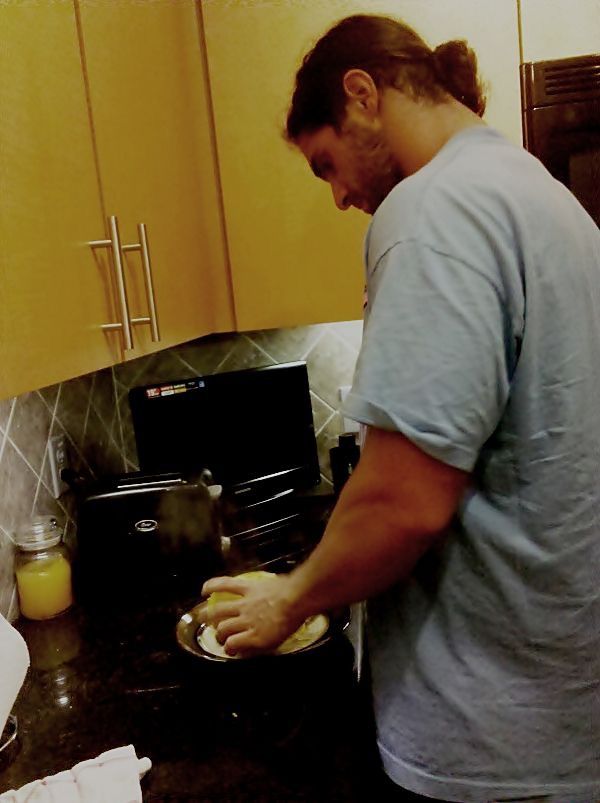
At what (x,y) coordinates should I click in order to perform the action: click on countertop. Please return your answer as a coordinate pair (x, y). This screenshot has height=803, width=600. Looking at the image, I should click on (50, 716).